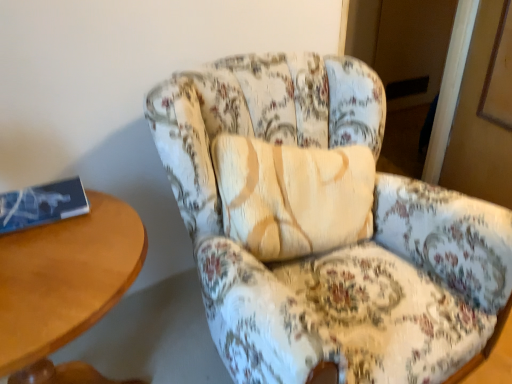
The width and height of the screenshot is (512, 384). Find the location of `floral fabric armchair at center`. floral fabric armchair at center is located at coordinates (323, 227).

Describe the element at coordinates (65, 287) in the screenshot. I see `wooden table at left` at that location.

Identify the location of floral fabric armchair at center. (323, 227).

Considering the sizes of wooden table at left and blue paper book at left in the image, is wooden table at left bigger or smaller than blue paper book at left?

Considering their sizes, wooden table at left takes up more space than blue paper book at left.

Is wooden table at left not close to blue paper book at left?

Actually, wooden table at left and blue paper book at left are a little close together.

Considering the relative positions of wooden table at left and blue paper book at left in the image provided, is wooden table at left in front of blue paper book at left?

Yes.

Which object is thinner, wooden table at left or blue paper book at left?

blue paper book at left is thinner.

From a real-world perspective, is blue paper book at left on top of floral fabric armchair at center?

Yes, from a real-world perspective, blue paper book at left is above floral fabric armchair at center.

Identify the location of book above the floral fabric armchair at center (from a real-world perspective). This screenshot has height=384, width=512. (42, 204).

Is blue paper book at left in front of floral fabric armchair at center?

No, blue paper book at left is behind floral fabric armchair at center.

Would you say blue paper book at left is outside floral fabric armchair at center?

Yes.

In the scene shown: Is floral fabric armchair at center facing towards wooden table at left?

No, floral fabric armchair at center is not turned towards wooden table at left.

Is floral fabric armchair at center to the left or to the right of wooden table at left in the image?

floral fabric armchair at center is positioned on wooden table at left's right side.

Is floral fabric armchair at center taller or shorter than wooden table at left?

Considering their sizes, floral fabric armchair at center has more height than wooden table at left.

Is floral fabric armchair at center facing away from blue paper book at left?

No.

Between point (346, 301) and point (52, 207), which one is positioned behind?

Positioned behind is point (346, 301).

Between floral fabric armchair at center and blue paper book at left, which one has less height?

Standing shorter between the two is blue paper book at left.

This screenshot has width=512, height=384. What are the coordinates of `book that is on the left side of floral fabric armchair at center` in the screenshot? It's located at (42, 204).

Which of these two, wooden table at left or floral fabric armchair at center, stands shorter?

wooden table at left.

Is floral fabric armchair at center completely or partially inside wooden table at left?

Actually, floral fabric armchair at center is outside wooden table at left.

Is point (17, 271) behind point (481, 300)?

That is False.

In the scene shown: Is wooden table at left placed right next to floral fabric armchair at center?

wooden table at left and floral fabric armchair at center are not in contact.

Which object is further away from the camera taking this photo, blue paper book at left or wooden table at left?

blue paper book at left is further from the camera.

From the image's perspective, does blue paper book at left appear higher than wooden table at left?

Yes, from the image's perspective, blue paper book at left is above wooden table at left.

Consider the image. Is blue paper book at left at the right side of wooden table at left?

No.

Could you tell me if blue paper book at left is turned towards wooden table at left?

No, blue paper book at left is not aimed at wooden table at left.

Identify the location of book on the left of wooden table at left. The height and width of the screenshot is (384, 512). (42, 204).

Identify the location of chair located in front of the blue paper book at left. The width and height of the screenshot is (512, 384). (323, 227).

From the image, which object appears to be nearer to wooden table at left, blue paper book at left or floral fabric armchair at center?

blue paper book at left lies closer to wooden table at left than the other object.

Based on their spatial positions, is floral fabric armchair at center or wooden table at left further from blue paper book at left?

Among the two, floral fabric armchair at center is located further to blue paper book at left.

Based on their spatial positions, is wooden table at left or blue paper book at left closer to floral fabric armchair at center?

Based on the image, wooden table at left appears to be nearer to floral fabric armchair at center.

From the image, which object appears to be farther from blue paper book at left, wooden table at left or floral fabric armchair at center?

floral fabric armchair at center.

Estimate the real-world distances between objects in this image. Which object is further from wooden table at left, floral fabric armchair at center or blue paper book at left?

floral fabric armchair at center.

From the image, which object appears to be nearer to floral fabric armchair at center, blue paper book at left or wooden table at left?

The object closer to floral fabric armchair at center is wooden table at left.

The image size is (512, 384). Find the location of `table between blue paper book at left and floral fabric armchair at center`. table between blue paper book at left and floral fabric armchair at center is located at coordinates (65, 287).